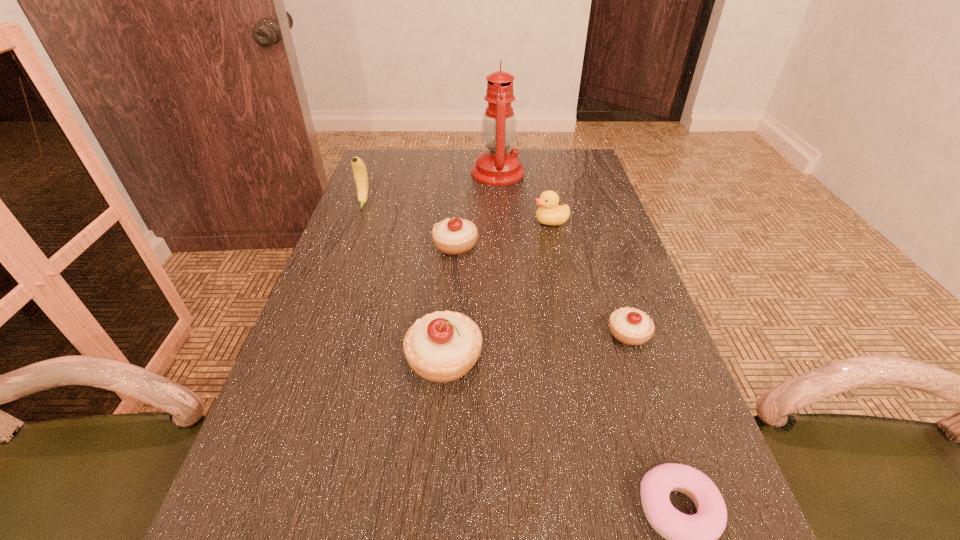
The height and width of the screenshot is (540, 960). Identify the location of the farthest object. (498, 166).

This screenshot has width=960, height=540. In order to click on the tallest object in this screenshot , I will do `click(498, 166)`.

Where is `the sixth nearest object`? The image size is (960, 540). the sixth nearest object is located at coordinates (359, 169).

Locate an element on the screen. The image size is (960, 540). banana is located at coordinates (359, 169).

Find the location of a particular element. the third tallest object is located at coordinates (443, 346).

At what (x,y) coordinates should I click in order to perform the action: click on the tallest pastry. Please return your answer as a coordinate pair (x, y). This screenshot has height=540, width=960. Looking at the image, I should click on (443, 346).

The image size is (960, 540). In order to click on yellow duckling in this screenshot , I will do `click(549, 213)`.

You are a GUI agent. You are given a task and a screenshot of the screen. Output one action in this format:
    pyautogui.click(x=<x>, y=<y>)
    Task: Click on the duckling
    This screenshot has height=540, width=960.
    Given the screenshot: What is the action you would take?
    pyautogui.click(x=549, y=213)

The width and height of the screenshot is (960, 540). I want to click on the second biggest beige pastry, so click(455, 236).

Where is `the third shortest pastry`? The height and width of the screenshot is (540, 960). the third shortest pastry is located at coordinates (455, 236).